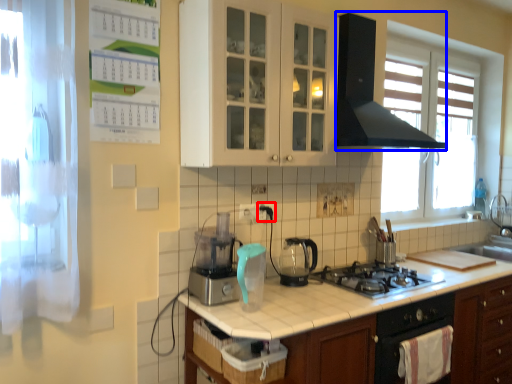
Question: Which object is further to the camera taking this photo, electric outlet (highlighted by a red box) or home appliance (highlighted by a blue box)?

Choices:
 (A) electric outlet
 (B) home appliance

Answer: (A)